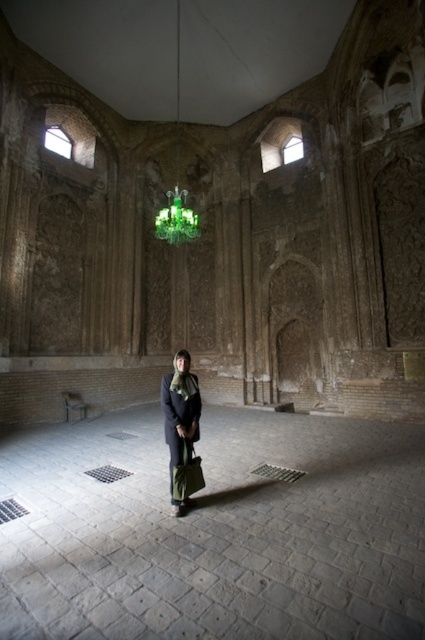
You are standing in the historical building and want to pick up the green fabric bag at center. Can you reach it without moving the green glass chandelier at upper center?

The green fabric bag at center is behind the green glass chandelier at upper center, so you can reach it without moving the chandelier since it is located behind it.

Based on the photo, you are standing in the historical building and want to take a photo of both point [190,413] and point [184,200]. Which point should you focus on first to ensure both are in focus?

You should focus on point [184,200] first because it is farther from the camera than point [190,413]. By focusing on the farther point, the closer point will also be within the depth of field.

Based on the photo, you are standing in the historical building and want to place a decorative item between the dark gray fabric scarf at center and the green glass chandelier at upper center. Based on their positions, where should you place the item?

The dark gray fabric scarf at center is to the right of the green glass chandelier at upper center, so you should place the decorative item between them on the left side of the scarf and the right side of the chandelier.